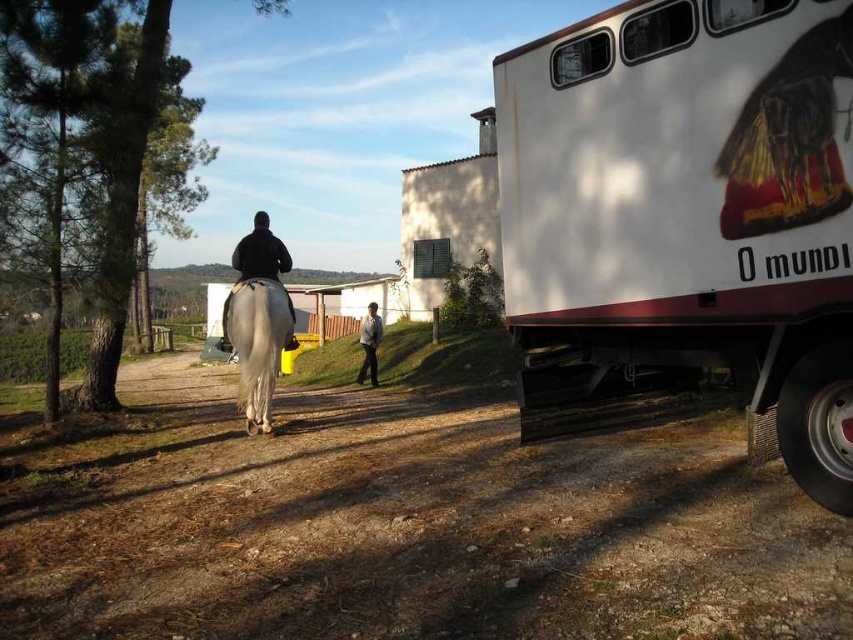
Question: Does brown dirt track at center appear over light gray fabric jacket at center?

Choices:
 (A) yes
 (B) no

Answer: (B)

Question: Can you confirm if brown dirt track at center is wider than white glossy horse at center?

Choices:
 (A) yes
 (B) no

Answer: (A)

Question: Among these points, which one is farthest from the camera?

Choices:
 (A) (258, 266)
 (B) (699, 220)
 (C) (257, 316)
 (D) (524, 532)

Answer: (A)

Question: Which of the following is the farthest from the observer?

Choices:
 (A) brown dirt track at center
 (B) white glossy trailer truck at right

Answer: (B)

Question: Based on their relative distances, which object is farther from the brown dirt track at center?

Choices:
 (A) white glossy trailer truck at right
 (B) black matte jacket at center
 (C) white glossy horse at center
 (D) light gray fabric jacket at center

Answer: (D)

Question: Where is white glossy trailer truck at right located in relation to black matte jacket at center in the image?

Choices:
 (A) right
 (B) left

Answer: (A)